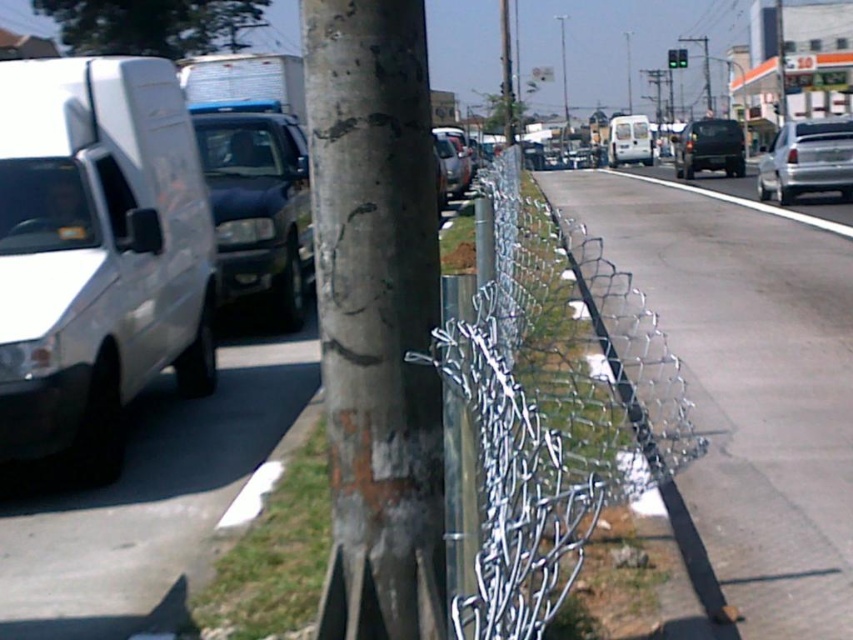
You are a pedestrian standing on the sidewalk near the damaged chain link fence. You see a point marked at coordinates [376,314]. What object is located at that point?

The point at coordinates [376,314] marks the rusty metal pole at center.